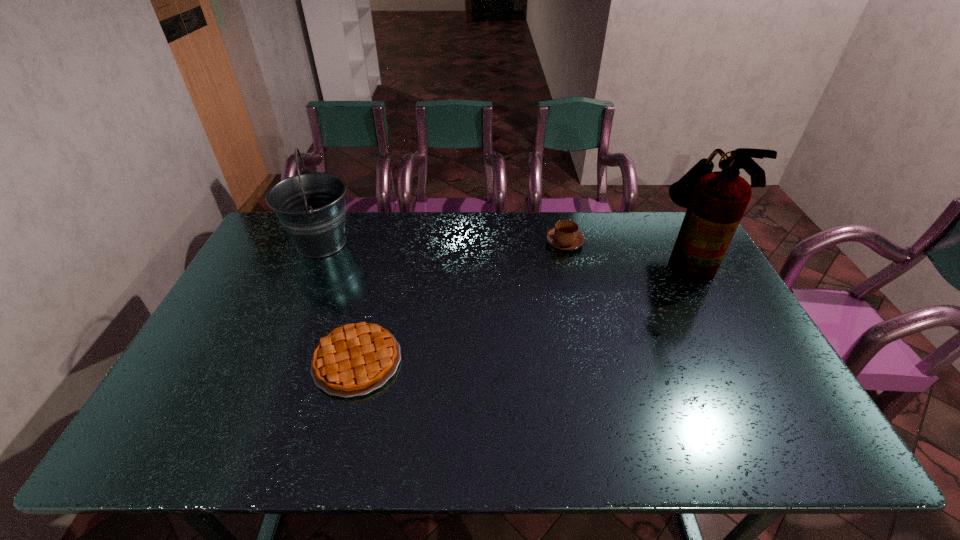
You are a GUI agent. You are given a task and a screenshot of the screen. Output one action in this format:
    pyautogui.click(x=<x>, y=<y>)
    Task: Click on the rightmost object
    
    Given the screenshot: What is the action you would take?
    click(x=716, y=201)

The image size is (960, 540). I want to click on the tallest object, so click(x=716, y=201).

Find the location of a particular element. This screenshot has width=960, height=540. the second tallest object is located at coordinates point(311,206).

Find the location of a particular element. the second shortest object is located at coordinates tap(565, 236).

Image resolution: width=960 pixels, height=540 pixels. I want to click on cappuccino, so click(565, 236).

Where is `the nearest object`? This screenshot has width=960, height=540. the nearest object is located at coordinates (354, 359).

Image resolution: width=960 pixels, height=540 pixels. What are the coordinates of `pie` in the screenshot? It's located at (354, 359).

Identify the location of vacant space situated 0.220m at the nozzle of the tallest object. The width and height of the screenshot is (960, 540). (597, 258).

Locate an element on the screen. The width and height of the screenshot is (960, 540). free space located 0.340m at the nozzle of the tallest object is located at coordinates (561, 258).

Image resolution: width=960 pixels, height=540 pixels. I want to click on vacant space located at the nozzle of the tallest object, so click(x=591, y=258).